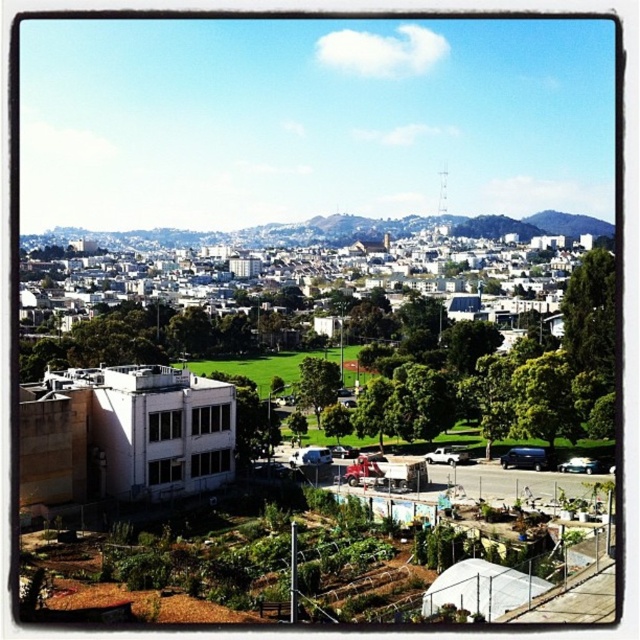
Is green grassy hillside at center above green leafy tree at center?

Correct, green grassy hillside at center is located above green leafy tree at center.

Which is more to the right, green grassy hillside at center or green leafy tree at center?

green leafy tree at center is more to the right.

Is point (560, 225) in front of point (328, 403)?

No.

Locate an element on the screen. The height and width of the screenshot is (640, 640). green grassy hillside at center is located at coordinates (332, 230).

Between green leafy tree at right and green leafy tree at center, which one is positioned higher?

Positioned higher is green leafy tree at right.

Is green leafy tree at right to the right of green leafy tree at center from the viewer's perspective?

Indeed, green leafy tree at right is positioned on the right side of green leafy tree at center.

Is point (568, 339) farther from camera compared to point (336, 394)?

No, it is in front of (336, 394).

You are a GUI agent. You are given a task and a screenshot of the screen. Output one action in this format:
    pyautogui.click(x=<x>, y=<y>)
    Task: Click on the green leafy tree at right
    The image size is (640, 640).
    Given the screenshot: What is the action you would take?
    pyautogui.click(x=589, y=316)

Does point (260, 227) come in front of point (602, 376)?

No.

Is point (548, 218) positioned after point (579, 362)?

Yes, it is behind point (579, 362).

Where is `green grassy hillside at center`? The width and height of the screenshot is (640, 640). green grassy hillside at center is located at coordinates 332,230.